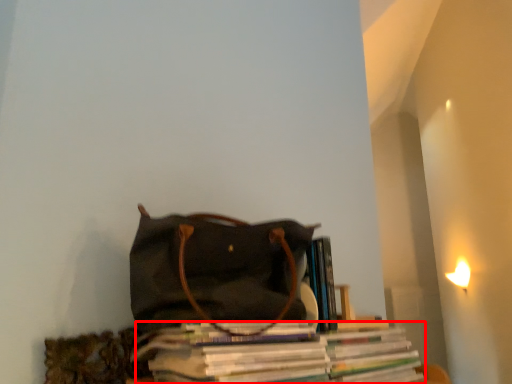
Question: From the image's perspective, considering the relative positions of magazine (annotated by the red box) and handbag in the image provided, where is magazine (annotated by the red box) located with respect to the staircase?

Choices:
 (A) above
 (B) below

Answer: (B)